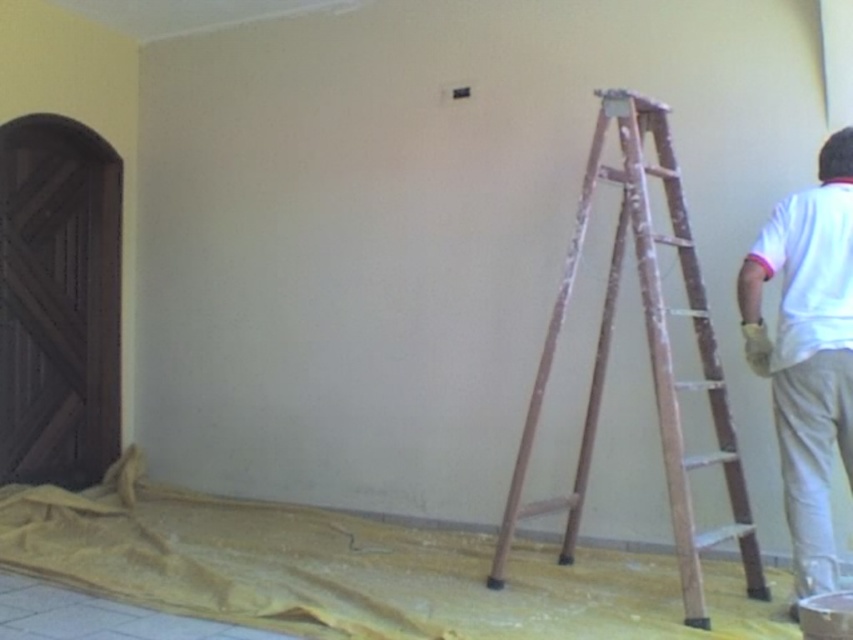
Question: Which object is farther from the camera taking this photo?

Choices:
 (A) wooden ladder at right
 (B) white cotton shirt at right
 (C) white matte shirt at right

Answer: (C)

Question: Which point is farther from the camera taking this photo?

Choices:
 (A) tap(521, 444)
 (B) tap(102, 259)
 (C) tap(753, 269)

Answer: (B)

Question: Does wooden ladder at right appear on the left side of white matte shirt at right?

Choices:
 (A) yes
 (B) no

Answer: (A)

Question: Among these objects, which one is nearest to the camera?

Choices:
 (A) white matte shirt at right
 (B) wooden ladder at right

Answer: (B)

Question: Can you confirm if dark wood barn door at left is positioned to the left of wooden ladder at right?

Choices:
 (A) yes
 (B) no

Answer: (A)

Question: Is dark wood barn door at left positioned behind white cotton shirt at right?

Choices:
 (A) yes
 (B) no

Answer: (A)